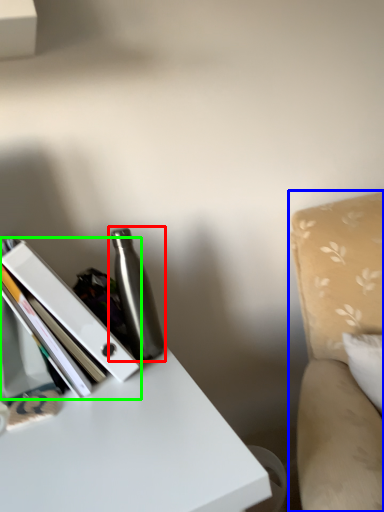
Question: Considering the real-world distances, which object is closest to bottle (highlighted by a red box)? swivel chair (highlighted by a blue box) or book (highlighted by a green box).

Choices:
 (A) swivel chair
 (B) book

Answer: (B)